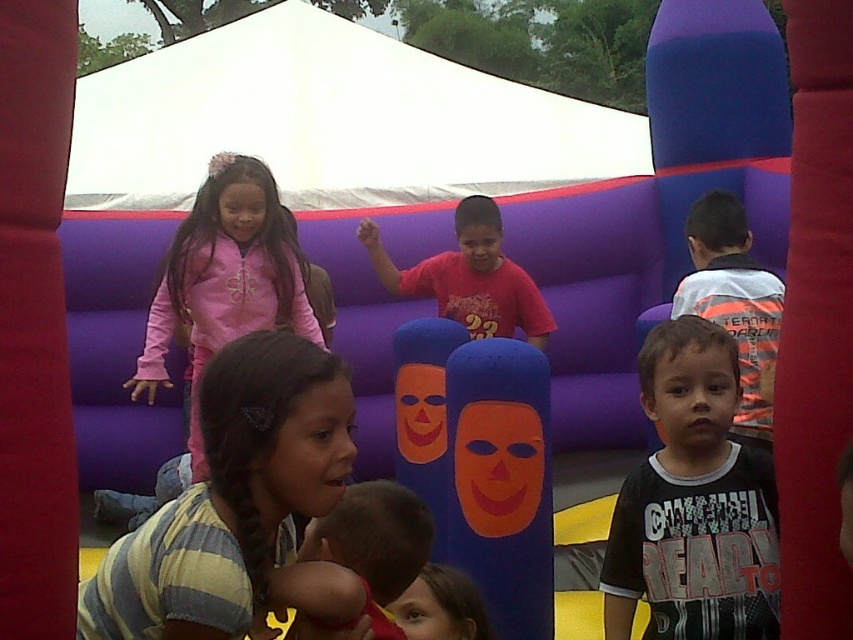
Question: Is striped cotton shirt at center to the right of pink fleece jacket at upper left from the viewer's perspective?

Choices:
 (A) no
 (B) yes

Answer: (B)

Question: Which of the following is the farthest from the observer?

Choices:
 (A) (292, 497)
 (B) (427, 556)
 (C) (668, 566)
 (D) (502, 260)

Answer: (D)

Question: Does striped cotton shirt at center appear over matte red shirt at center?

Choices:
 (A) no
 (B) yes

Answer: (A)

Question: Estimate the real-world distances between objects in this image. Which object is farther from the matte red shirt at center?

Choices:
 (A) pink fleece jacket at upper left
 (B) striped cotton shirt at center

Answer: (B)

Question: Which object is closer to the camera taking this photo?

Choices:
 (A) matte red shirt at center
 (B) pink fleece jacket at upper left
 (C) striped cotton shirt at center

Answer: (C)

Question: Does pink fleece jacket at upper left appear on the right side of smooth skin baby at lower center?

Choices:
 (A) no
 (B) yes

Answer: (A)